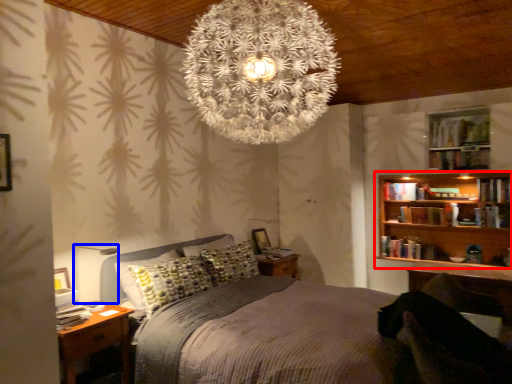
Question: Which object appears closest to the camera in this image, bookcase (highlighted by a red box) or table lamp (highlighted by a blue box)?

Choices:
 (A) bookcase
 (B) table lamp

Answer: (B)